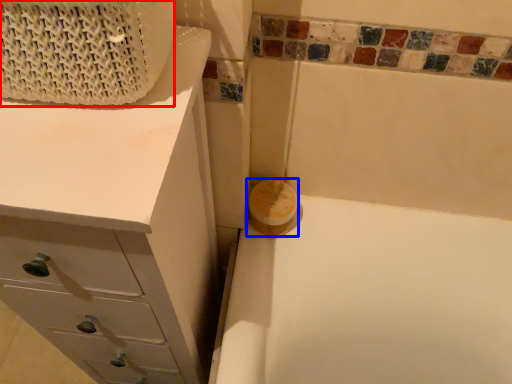
Question: Which object is closer to the camera taking this photo, basket (highlighted by a red box) or soap (highlighted by a blue box)?

Choices:
 (A) basket
 (B) soap

Answer: (A)